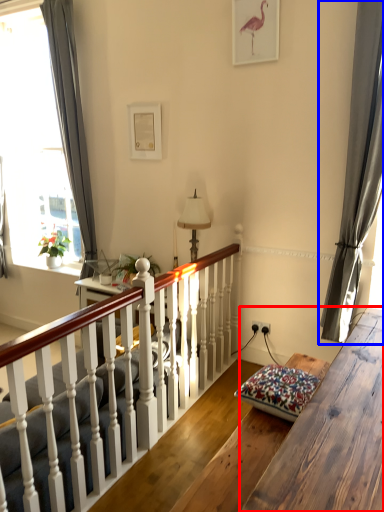
Question: Which object appears farthest to the camera in this image, table (highlighted by a red box) or curtain (highlighted by a blue box)?

Choices:
 (A) table
 (B) curtain

Answer: (B)